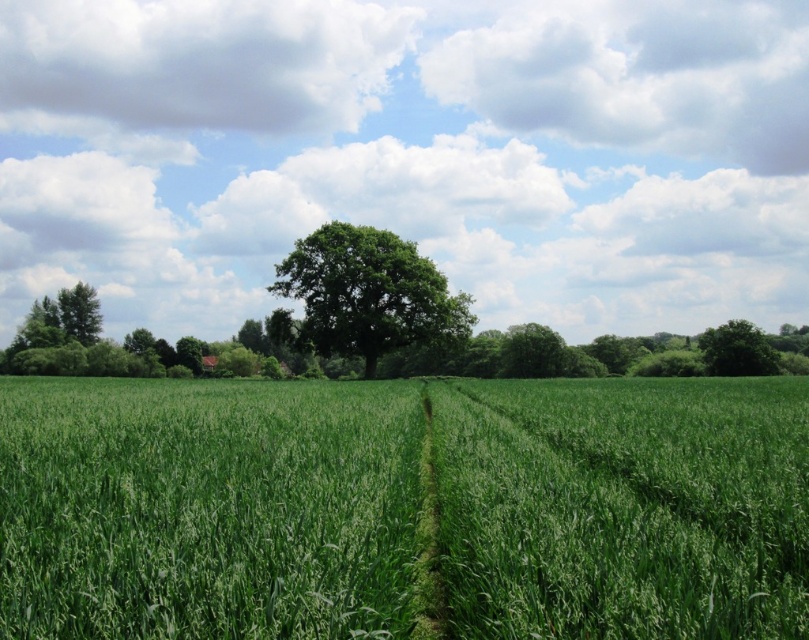
Who is positioned more to the left, green grassy wheat field at center or green leafy tree at right?

green grassy wheat field at center is more to the left.

Is point (726, 429) closer to camera compared to point (733, 372)?

Yes.

Does point (185, 426) lie in front of point (755, 371)?

Yes, point (185, 426) is in front of point (755, 371).

The width and height of the screenshot is (809, 640). I want to click on green grassy wheat field at center, so click(x=206, y=508).

Who is more distant from viewer, (324, 292) or (742, 337)?

The point (742, 337) is behind.

Which is below, green leafy tree at center or green leafy tree at right?

green leafy tree at right is below.

In order to click on green leafy tree at center in this screenshot , I will do (x=366, y=294).

Does green grassy wheat field at center appear on the left side of green leafy tree at center?

No, green grassy wheat field at center is not to the left of green leafy tree at center.

Is point (151, 532) behind point (270, 333)?

No, it is in front of (270, 333).

I want to click on green grassy wheat field at center, so (x=206, y=508).